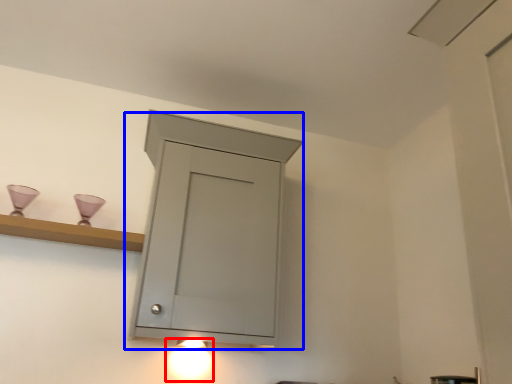
Question: Which point is closer to the camera, light fixture (highlighted by a red box) or cupboard (highlighted by a blue box)?

Choices:
 (A) light fixture
 (B) cupboard

Answer: (B)